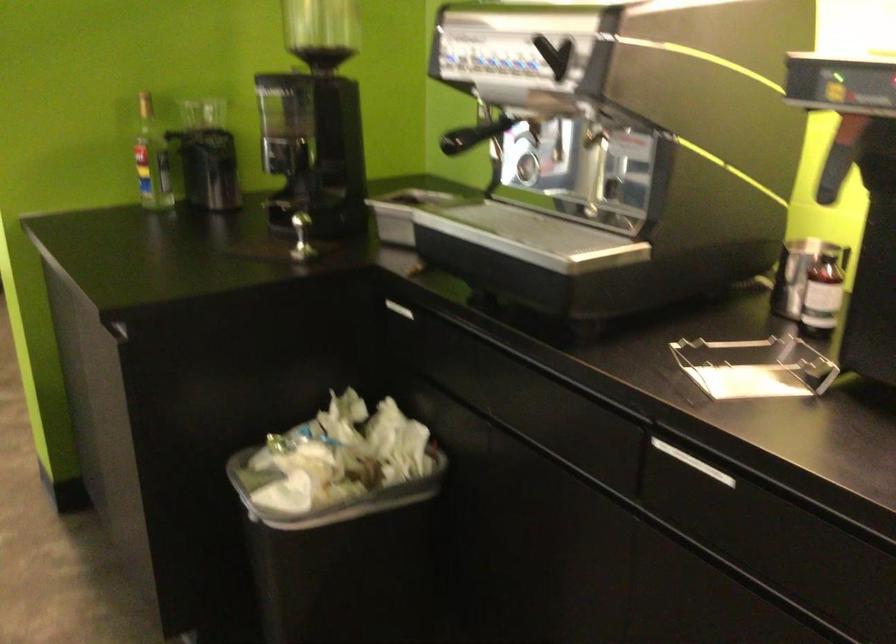
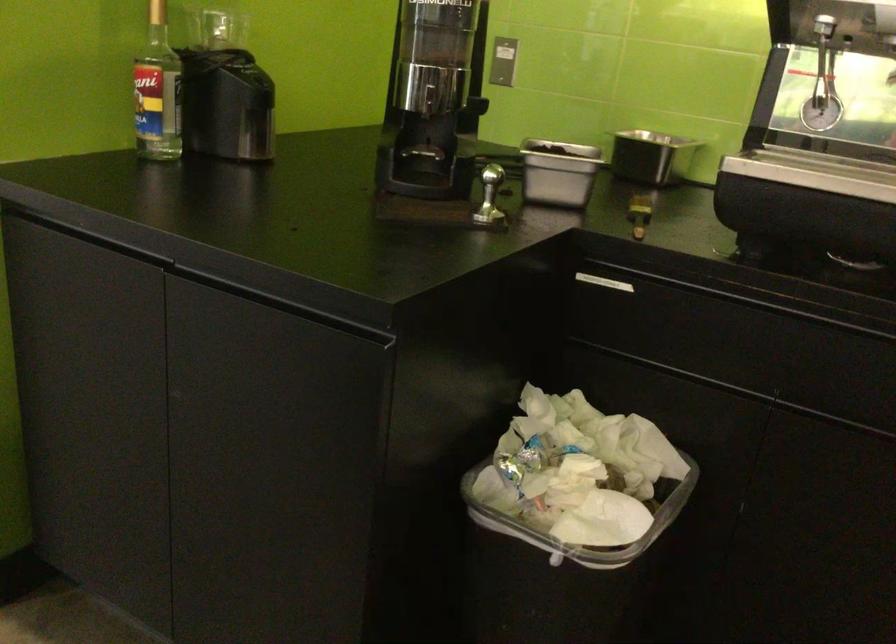
Which direction would the cameraman need to move to produce the second image?

The cameraman moved toward left, forward.